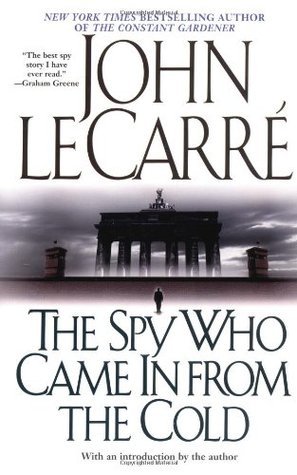
At what (x,y) coordinates should I click in order to perform the action: click on archway. Please return your answer as a coordinate pair (x, y). This screenshot has width=297, height=475. Looking at the image, I should click on (114, 254), (135, 256), (154, 253), (181, 254), (202, 258).